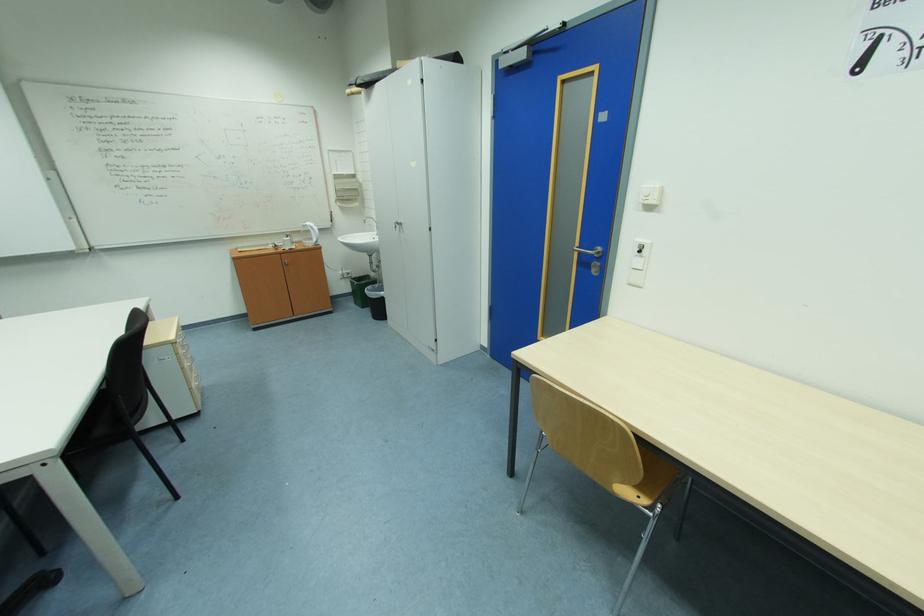
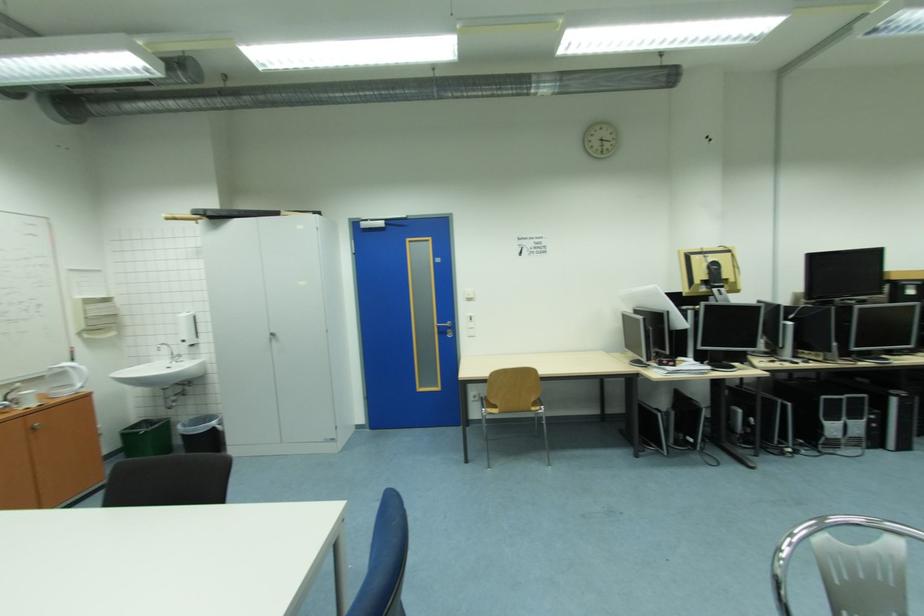
Find the pixel in the second image that matches (x=587, y=253) in the first image.

(445, 328)